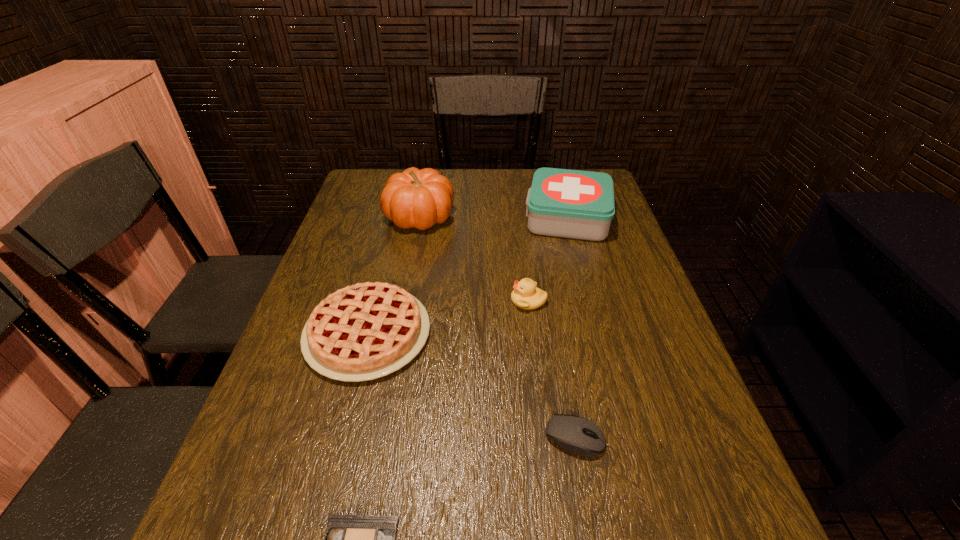
Locate an element on the screen. The image size is (960, 540). the tallest object is located at coordinates (416, 198).

You are a GUI agent. You are given a task and a screenshot of the screen. Output one action in this format:
    pyautogui.click(x=<x>, y=<y>)
    Task: Click on the second tallest object
    The width and height of the screenshot is (960, 540).
    Given the screenshot: What is the action you would take?
    pyautogui.click(x=576, y=204)

I want to click on the third tallest object, so click(526, 295).

This screenshot has width=960, height=540. I want to click on the third shortest object, so click(365, 331).

Locate an element on the screen. computer equipment is located at coordinates [x=568, y=431].

You are a GUI agent. You are given a task and a screenshot of the screen. Output one action in this format:
    pyautogui.click(x=<x>, y=<y>)
    Task: Click on the fifth tallest object
    The width and height of the screenshot is (960, 540).
    Given the screenshot: What is the action you would take?
    pyautogui.click(x=568, y=431)

The height and width of the screenshot is (540, 960). In order to click on free region located 0.090m on the back of the tallest object in this screenshot , I will do `click(425, 185)`.

Locate an element on the screen. This screenshot has height=540, width=960. vacant space located on the front of the first-aid kit is located at coordinates (580, 262).

Where is `blank area located at the face of the fourth shortest object`? blank area located at the face of the fourth shortest object is located at coordinates (466, 301).

Where is `free space located 0.280m at the face of the fourth shortest object`? The height and width of the screenshot is (540, 960). free space located 0.280m at the face of the fourth shortest object is located at coordinates 396,301.